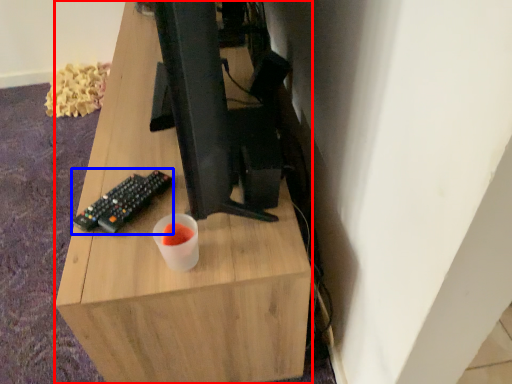
Question: Which object appears farthest to the camera in this image, desk (highlighted by a red box) or computer keyboard (highlighted by a blue box)?

Choices:
 (A) desk
 (B) computer keyboard

Answer: (B)